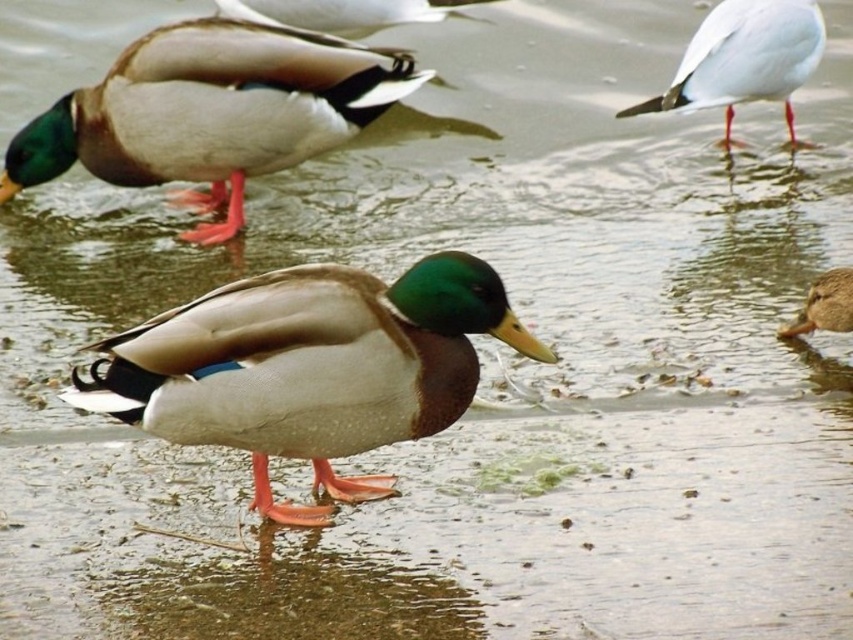
Can you confirm if matte brown duck at center is shorter than brown matte duck at lower right?

Incorrect, matte brown duck at center's height does not fall short of brown matte duck at lower right's.

Which is above, matte brown duck at center or brown matte duck at lower right?

brown matte duck at lower right is above.

The image size is (853, 640). Identify the location of matte brown duck at center. (309, 368).

Who is positioned more to the left, matte brown duck at center or white matte seagull at upper right?

matte brown duck at center

Is point (338, 317) in front of point (817, 13)?

Yes, it is in front of point (817, 13).

You are a GUI agent. You are given a task and a screenshot of the screen. Output one action in this format:
    pyautogui.click(x=<x>, y=<y>)
    Task: Click on the matte brown duck at center
    The height and width of the screenshot is (640, 853).
    Given the screenshot: What is the action you would take?
    pyautogui.click(x=309, y=368)

Between shiny brown duck at upper left and brown matte duck at lower right, which one is positioned higher?

shiny brown duck at upper left

Does shiny brown duck at upper left appear under brown matte duck at lower right?

Actually, shiny brown duck at upper left is above brown matte duck at lower right.

The width and height of the screenshot is (853, 640). Describe the element at coordinates (212, 112) in the screenshot. I see `shiny brown duck at upper left` at that location.

Where is `shiny brown duck at upper left`? The width and height of the screenshot is (853, 640). shiny brown duck at upper left is located at coordinates (212, 112).